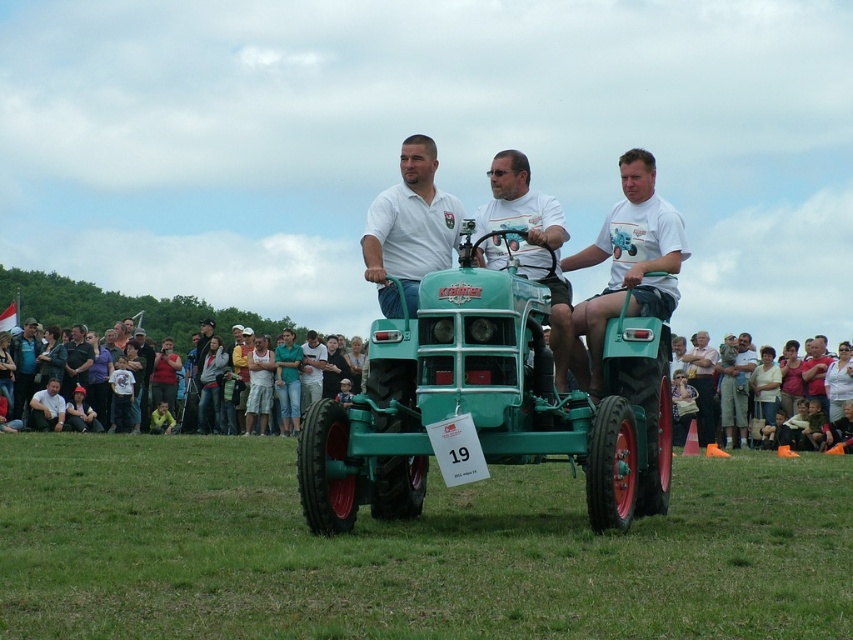
You are a photographer trying to capture a clear shot of the green rubber tractor at center and the matte white shirt at center. Since you want the tractor to be the main focus, which object should you position closer to the camera to ensure it appears larger in the photo?

To make the green rubber tractor at center appear larger in the photo, you should position it closer to the camera. However, according to the description, the green rubber tractor at center is shorter than the matte white shirt at center. Therefore, to emphasize the tractor as the main focus, you might need to adjust the camera angle or use other techniques since its actual height is less than the matte white shirt at center.

In the scene shown: You are a drone operator trying to capture aerial footage of the tractor pulling event. The green matte tractor at center is located at coordinates point 0.631, 0.573. If your drone is currently at point 0.5, 0.5, which direction should you move the drone to get closer to the tractor?

The green matte tractor at center is located at point (x=488, y=403). Since your drone is at (x=426, y=320), you should move the drone northeast to reach the tractor.